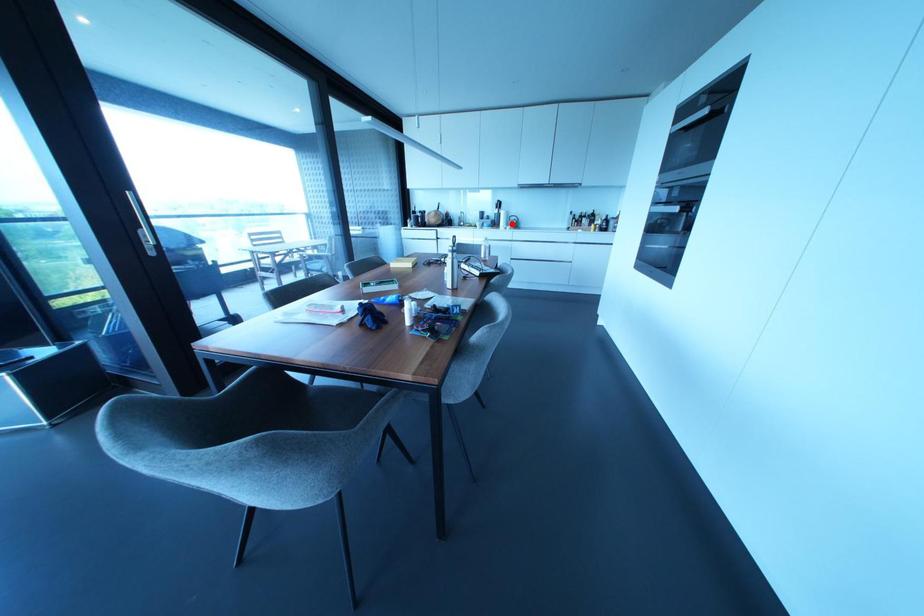
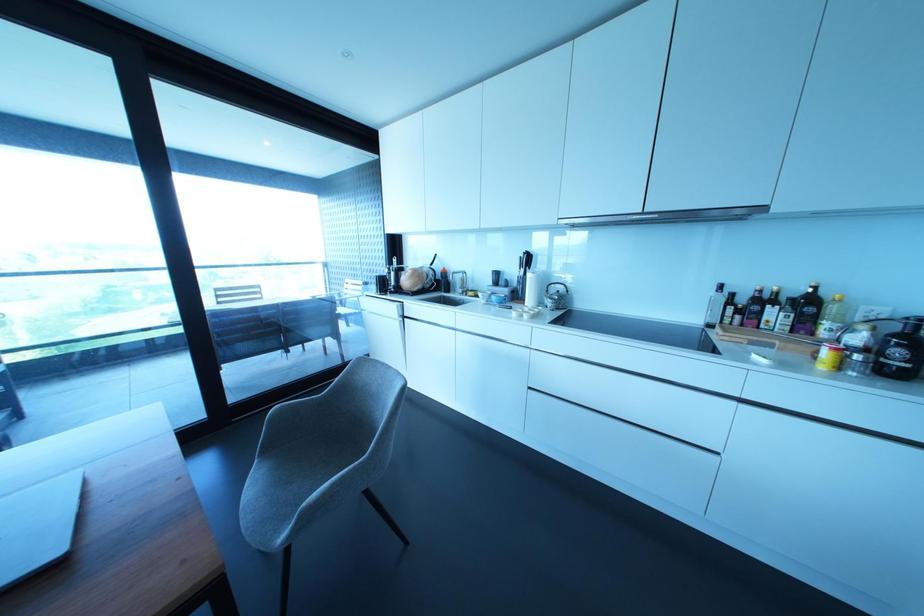
Question: I am providing you with two images of the same scene from different viewpoints. Given a red point in image1, look at the same physical point in image2. Is it:

Choices:
 (A) Closer to the viewpoint
 (B) Farther from the viewpoint

Answer: (B)